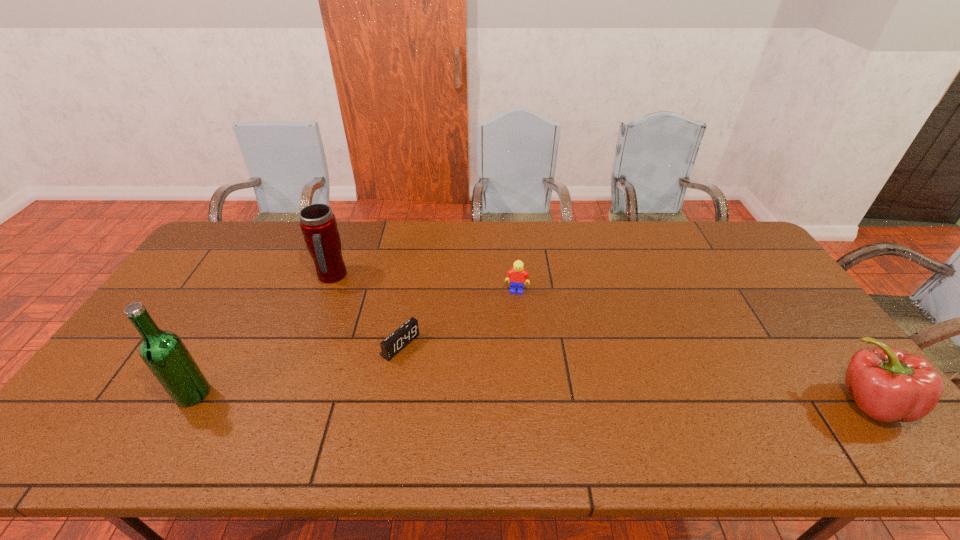
This screenshot has height=540, width=960. What are the coordinates of `free spot on the desktop that is between the leftmost object and the pepper and is positioned on the front-facing side of the alarm clock` in the screenshot? It's located at (479, 397).

The height and width of the screenshot is (540, 960). In order to click on free spot on the desktop that is between the leftmost object and the third tallest object and is positioned on the side with the handle of the fourth shortest object in this screenshot , I will do `click(512, 397)`.

In order to click on free space on the desktop that is between the tallest object and the pepper and is positioned on the front-facing side of the fourth tallest object in this screenshot , I will do `click(502, 397)`.